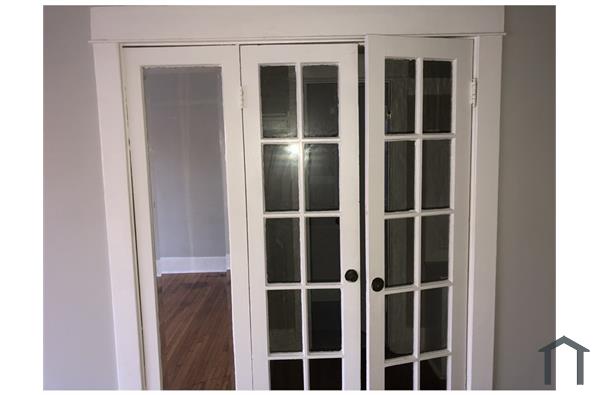
Identify the location of side wall. The height and width of the screenshot is (395, 600). (515, 257).